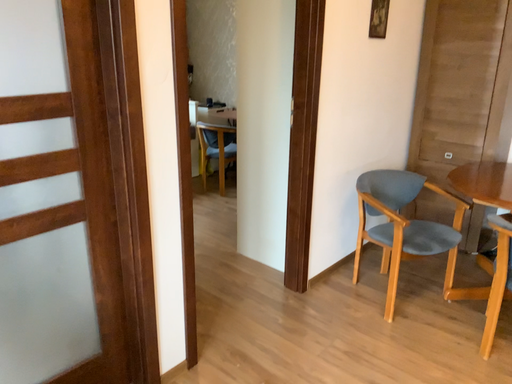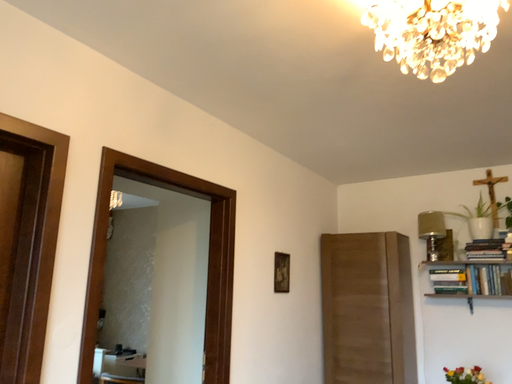
Question: Which way did the camera rotate in the video?

Choices:
 (A) rotated left
 (B) rotated right

Answer: (B)